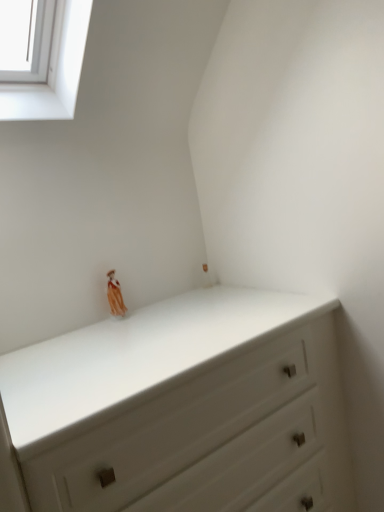
This screenshot has width=384, height=512. Find the location of `empty space that is ontop of white matte chest of drawers at center`. empty space that is ontop of white matte chest of drawers at center is located at coordinates (150, 332).